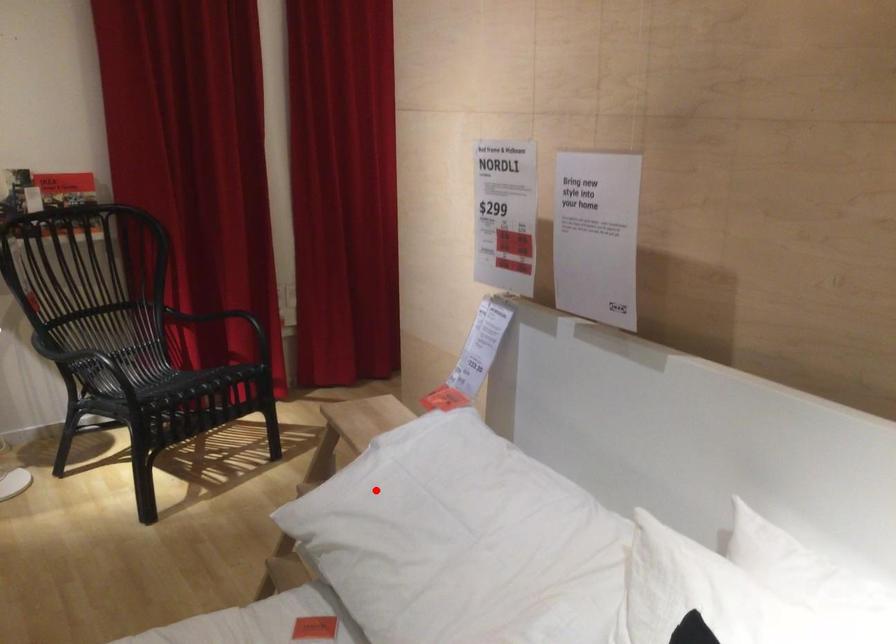
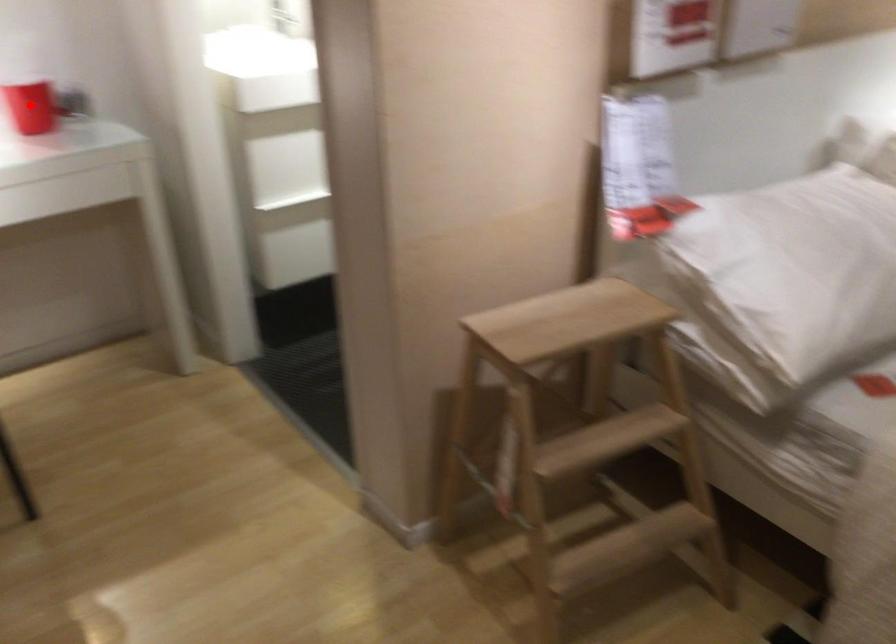
I am providing you with two images of the same scene from different viewpoints. A red point is marked on the first image and another point is marked on the second image. Are the points marked in image1 and image2 representing the same 3D position?

No